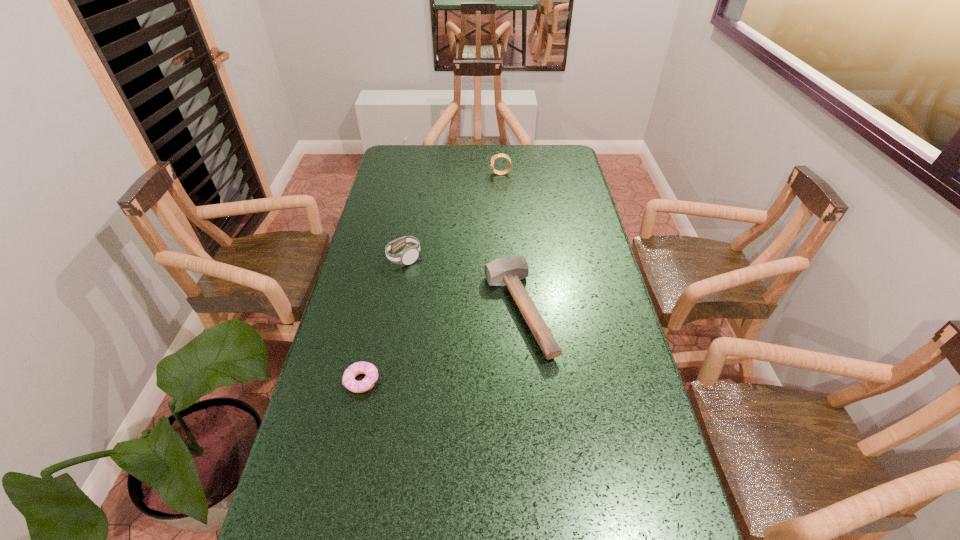
You are a GUI agent. You are given a task and a screenshot of the screen. Output one action in this format:
    pyautogui.click(x=<x>, y=<y>)
    Task: Click on the farthest object
    
    Given the screenshot: What is the action you would take?
    pyautogui.click(x=487, y=539)

At what (x,y) coordinates should I click in order to perform the action: click on the right watch. Please return your answer as a coordinate pair (x, y). Image resolution: width=960 pixels, height=540 pixels. Looking at the image, I should click on (487, 539).

Find the location of `the left watch`. the left watch is located at coordinates (409, 254).

Locate an element on the screen. mallet is located at coordinates (509, 270).

Locate an element on the screen. Image resolution: width=960 pixels, height=540 pixels. the shortest object is located at coordinates [x=348, y=380].

Find the location of a particular element. The width and height of the screenshot is (960, 540). the nearest object is located at coordinates pyautogui.click(x=348, y=380).

Where is `vacant space situated 0.360m on the face of the farthest object`? The image size is (960, 540). vacant space situated 0.360m on the face of the farthest object is located at coordinates (407, 174).

At what (x,y) coordinates should I click in order to perform the action: click on vacant point located on the face of the farthest object. Please return your answer as a coordinate pair (x, y). Looking at the image, I should click on (458, 174).

The image size is (960, 540). Identify the location of vacant position located on the face of the farthest object. (442, 174).

Identify the location of free space located on the face of the left watch. (519, 258).